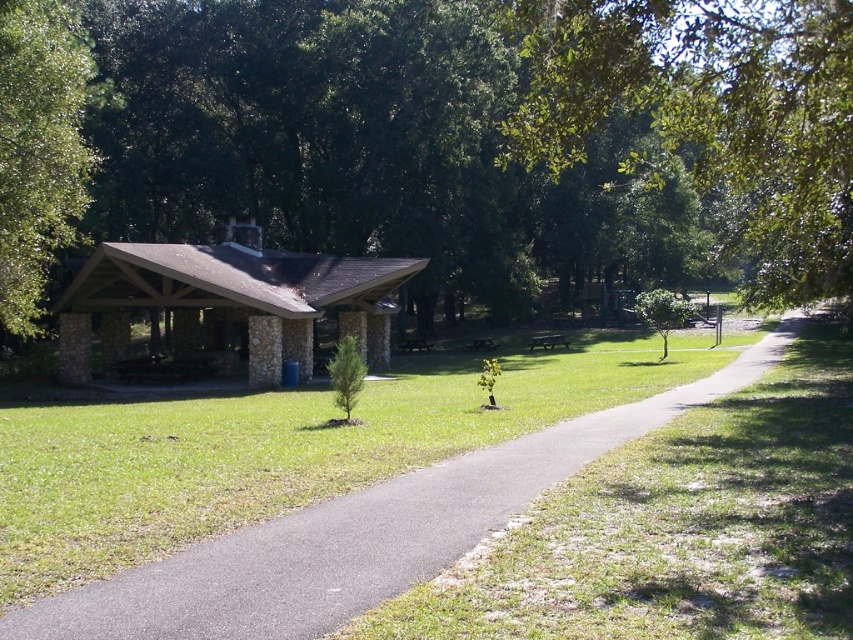
Is asphalt at center above green leafy tree at left?

No, asphalt at center is not above green leafy tree at left.

Can you confirm if asphalt at center is bigger than green leafy tree at left?

No, asphalt at center is not bigger than green leafy tree at left.

Between point (347, 596) and point (62, 180), which one is positioned behind?

Point (62, 180)

What are the coordinates of `asphalt at center` in the screenshot? It's located at (360, 534).

Which is more to the right, green leafy tree at upper right or green leafy tree at left?

green leafy tree at upper right is more to the right.

Does green leafy tree at upper right appear on the right side of green leafy tree at left?

Yes, green leafy tree at upper right is to the right of green leafy tree at left.

Which is in front, point (706, 77) or point (10, 218)?

Point (706, 77) is in front.

Find the location of a particular element. Image resolution: width=853 pixels, height=640 pixels. green leafy tree at upper right is located at coordinates (711, 115).

What are the coordinates of `green leafy tree at center` in the screenshot? It's located at click(x=433, y=134).

Does green leafy tree at center have a smaller size compared to metallic silver picnic table at center?

Incorrect, green leafy tree at center is not smaller in size than metallic silver picnic table at center.

The height and width of the screenshot is (640, 853). Describe the element at coordinates (433, 134) in the screenshot. I see `green leafy tree at center` at that location.

The image size is (853, 640). Find the location of `green leafy tree at center`. green leafy tree at center is located at coordinates (433, 134).